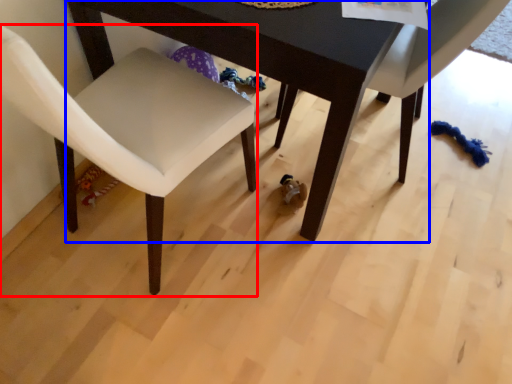
Question: Among these objects, which one is nearest to the camera, chair (highlighted by a red box) or table (highlighted by a blue box)?

Choices:
 (A) chair
 (B) table

Answer: (A)